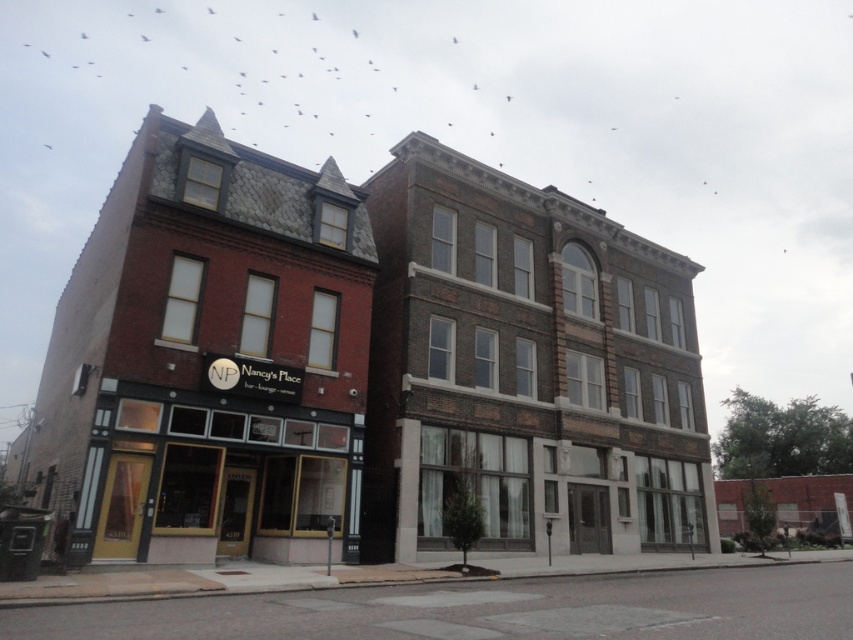
From the picture: You are a delivery person needing to park your van. The van requires a space that is at least as wide as the matte glass storefront at center. Can you park your van next to the brick building at center?

The brick building at center is wider than the matte glass storefront at center. Since the van requires a space at least as wide as the matte glass storefront at center, the parking space next to the brick building at center should be sufficient as the brick building at center provides adequate width.

You are standing outside the entrance of NP Nancy Place bar lounge venue. You want to take a photo of the brick building at center and the matte glass storefront at center. Which one should you focus on first if you want to capture both in the frame without moving the camera?

You should focus on the matte glass storefront at center first because the brick building at center is to the right of it, so by centering the matte glass storefront, you can include both in the frame without moving the camera.